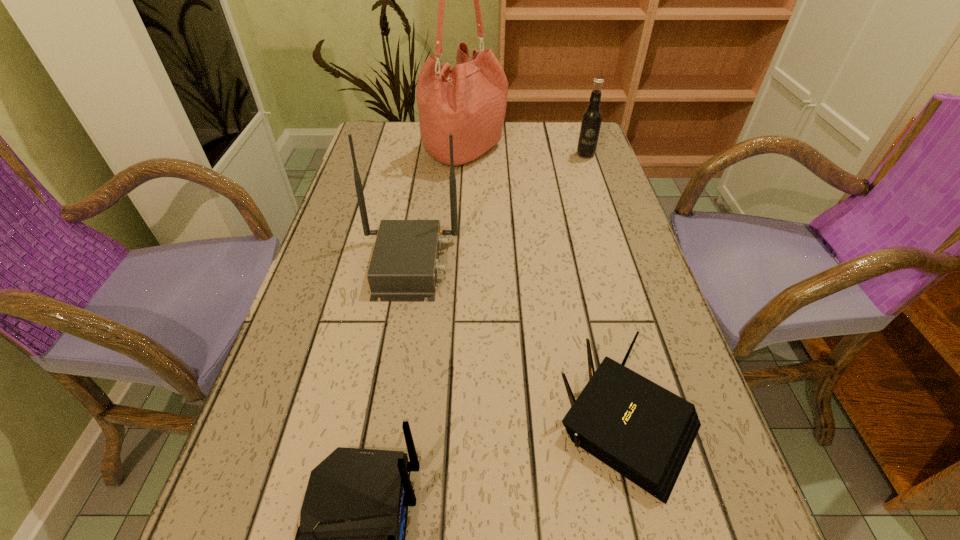
Image resolution: width=960 pixels, height=540 pixels. In order to click on handbag situated at the far edge in this screenshot , I will do `click(469, 101)`.

Find the location of `root beer located in the far edge section of the desktop`. root beer located in the far edge section of the desktop is located at coordinates (591, 120).

This screenshot has height=540, width=960. Find the location of `object at the left edge`. object at the left edge is located at coordinates (404, 266).

You are a GUI agent. You are given a task and a screenshot of the screen. Output one action in this format:
    pyautogui.click(x=<x>, y=<y>)
    Task: Click on the root beer present at the right edge
    Image resolution: width=960 pixels, height=540 pixels.
    Given the screenshot: What is the action you would take?
    pyautogui.click(x=591, y=120)

This screenshot has height=540, width=960. I want to click on router that is at the right edge, so click(641, 430).

Find the location of a particular element. object located in the far right corner section of the desktop is located at coordinates (591, 120).

In the image, there is a desktop. Find the location of `blank space at the far edge`. blank space at the far edge is located at coordinates (504, 123).

The image size is (960, 540). In the image, there is a desktop. In order to click on vacant region at the left edge in this screenshot , I will do `click(344, 400)`.

What are the coordinates of `free space at the right edge` in the screenshot? It's located at 612,202.

In order to click on vacant space at the far right corner in this screenshot , I will do `click(576, 127)`.